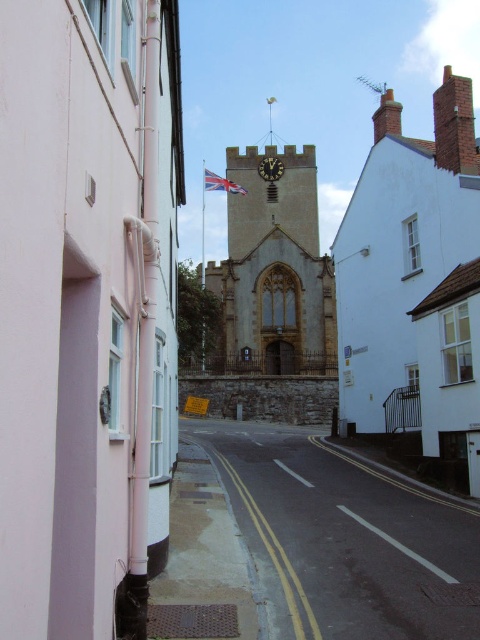
You are standing on the street looking at the church tower. The red fabric flag at center and the gold metallic clock at center are both visible. Which object is positioned closer to you?

The red fabric flag at center is closer to the viewer than the gold metallic clock at center.

Based on the photo, you are a painter who wants to hang a large painting on the wall. Given that the painting is taller than the red fabric flag at center, will it fit on the white smooth wall at left?

The white smooth wall at left has a greater height compared to the red fabric flag at center, so the painting, which is taller than the flag, should fit on the white smooth wall at left.

Based on the photo, you are a tourist standing on the street in front of the white brick church at center and the gold metallic clock at center. You want to take a photo that includes both objects in the frame. Which object should you position closer to the edge of the frame to ensure both fit in the shot?

Since the white brick church at center is wider than the gold metallic clock at center, you should position the white brick church at center closer to the edge of the frame to make space for the narrower gold metallic clock at center within the shot.